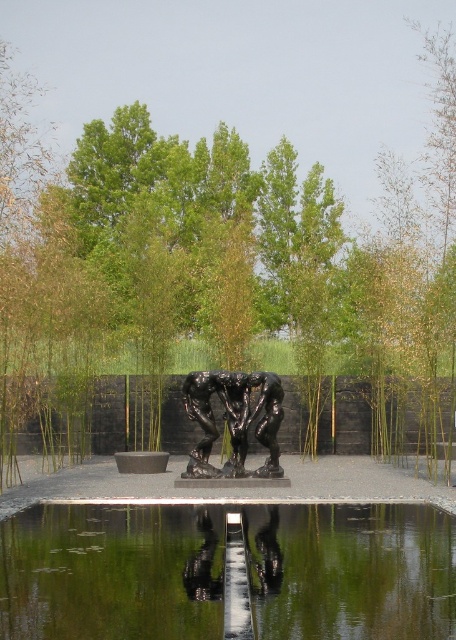
Is transparent glass water at center in front of black polished bronze sculpture at center?

That is True.

Is point (410, 524) farther from camera compared to point (202, 470)?

No, (410, 524) is closer to viewer.

Between point (9, 621) and point (203, 456), which one is positioned in front?

Point (9, 621)

Where is `transparent glass water at center`? transparent glass water at center is located at coordinates (113, 572).

Is green leafy tree at center below transparent glass water at center?

Incorrect, green leafy tree at center is not positioned below transparent glass water at center.

Does green leafy tree at center appear on the left side of transparent glass water at center?

Correct, you'll find green leafy tree at center to the left of transparent glass water at center.

I want to click on green leafy tree at center, so click(243, 76).

How far apart are green leafy tree at center and black polished bronze sculpture at center?

green leafy tree at center is 27.43 meters away from black polished bronze sculpture at center.

Between green leafy tree at center and black polished bronze sculpture at center, which one appears on the right side from the viewer's perspective?

From the viewer's perspective, black polished bronze sculpture at center appears more on the right side.

Describe the element at coordinates (243, 76) in the screenshot. This screenshot has height=640, width=456. I see `green leafy tree at center` at that location.

Locate an element on the screen. This screenshot has width=456, height=640. green leafy tree at center is located at coordinates (243, 76).